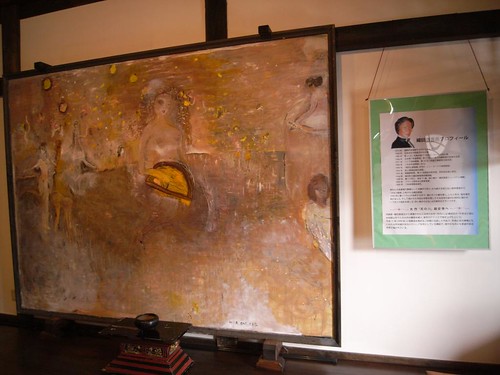
The width and height of the screenshot is (500, 375). In order to click on art work in this screenshot , I will do `click(159, 206)`, `click(79, 265)`, `click(245, 289)`, `click(274, 177)`, `click(53, 148)`.